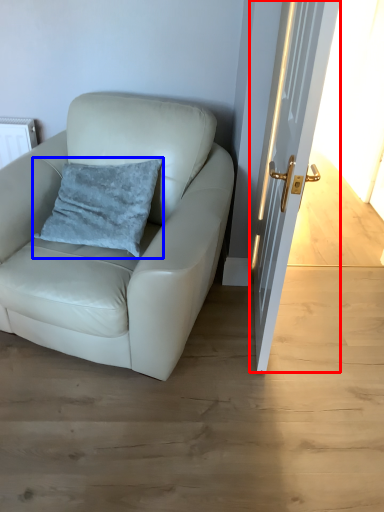
Question: Which object appears farthest to the camera in this image, door (highlighted by a red box) or pillow (highlighted by a blue box)?

Choices:
 (A) door
 (B) pillow

Answer: (B)